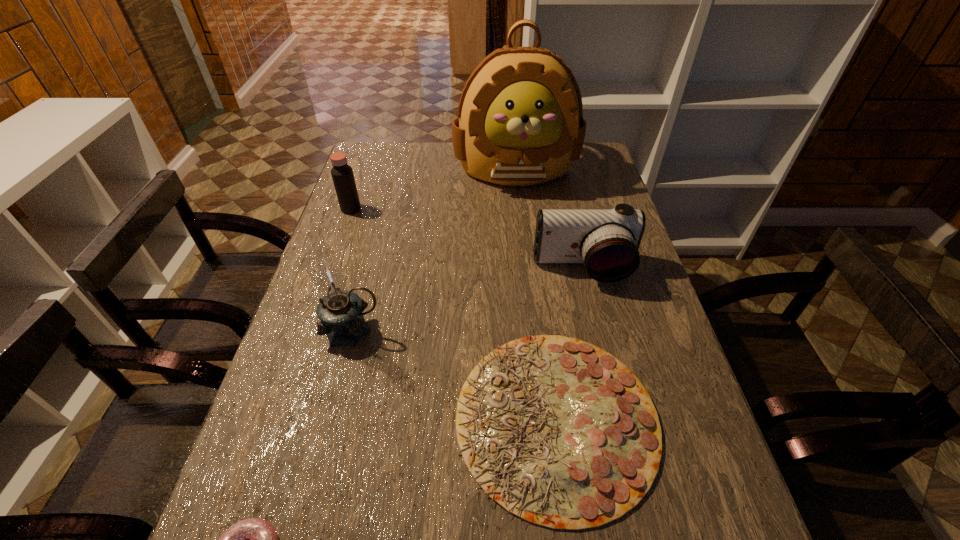
Identify the location of free spot located on the left of the pizza. The width and height of the screenshot is (960, 540). (302, 419).

The image size is (960, 540). I want to click on object that is at the far edge, so click(x=520, y=122).

The height and width of the screenshot is (540, 960). Find the location of `oil lamp located in the left edge section of the desktop`. oil lamp located in the left edge section of the desktop is located at coordinates (340, 311).

Find the location of `vinegar present at the left edge`. vinegar present at the left edge is located at coordinates (342, 174).

Image resolution: width=960 pixels, height=540 pixels. What are the coordinates of `backpack that is at the right edge` in the screenshot? It's located at (520, 122).

Locate an element on the screen. camcorder present at the right edge is located at coordinates (607, 241).

Where is `pizza located in the right edge section of the desktop`? This screenshot has height=540, width=960. pizza located in the right edge section of the desktop is located at coordinates (560, 433).

Identify the location of object located in the far right corner section of the desktop. The image size is (960, 540). (520, 122).

Where is `vacant position at the far edge of the desktop`? vacant position at the far edge of the desktop is located at coordinates (428, 156).

Where is `blank space at the left edge of the desktop`? This screenshot has width=960, height=540. blank space at the left edge of the desktop is located at coordinates (372, 237).